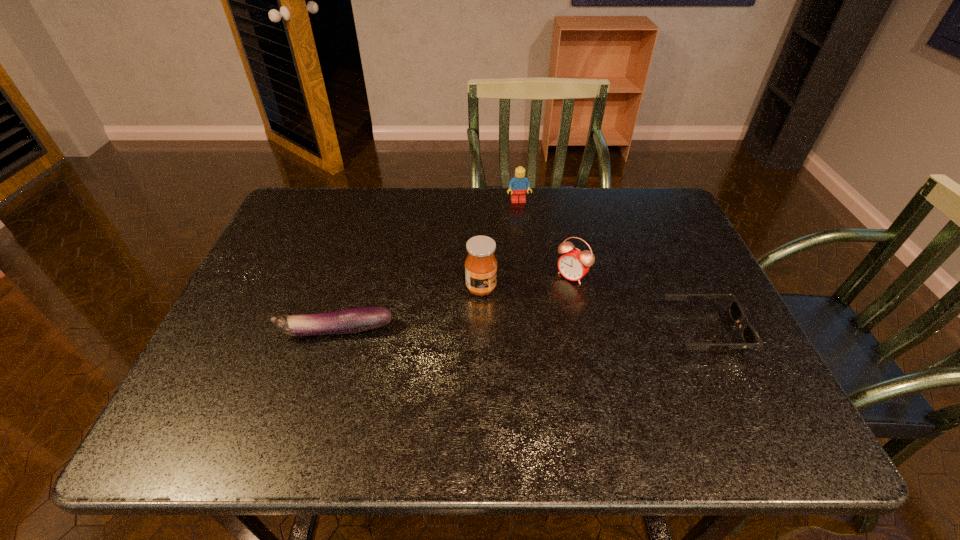
This screenshot has width=960, height=540. I want to click on object located at the left edge, so click(x=359, y=319).

This screenshot has height=540, width=960. Identify the location of object located at the right edge. (750, 337).

In the image, there is a desktop. Where is `free space at the far edge`? free space at the far edge is located at coordinates (353, 218).

Where is `vacant space at the near edge`? vacant space at the near edge is located at coordinates (405, 376).

Identify the location of vacant region at the left edge. (239, 302).

Locate an element on the screen. The image size is (960, 540). free space at the right edge of the desktop is located at coordinates (676, 307).

The height and width of the screenshot is (540, 960). Find the location of `vacant space at the far left corner of the desktop`. vacant space at the far left corner of the desktop is located at coordinates (308, 232).

Where is `blank region between the second shortest object and the second object from left to right`? The height and width of the screenshot is (540, 960). blank region between the second shortest object and the second object from left to right is located at coordinates (408, 309).

Locate an element on the screen. This screenshot has height=540, width=960. vacant space that's between the rightmost object and the honey is located at coordinates (593, 309).

Where is `free area in between the rightmost object and the fourth object from left to right`? The width and height of the screenshot is (960, 540). free area in between the rightmost object and the fourth object from left to right is located at coordinates (638, 303).